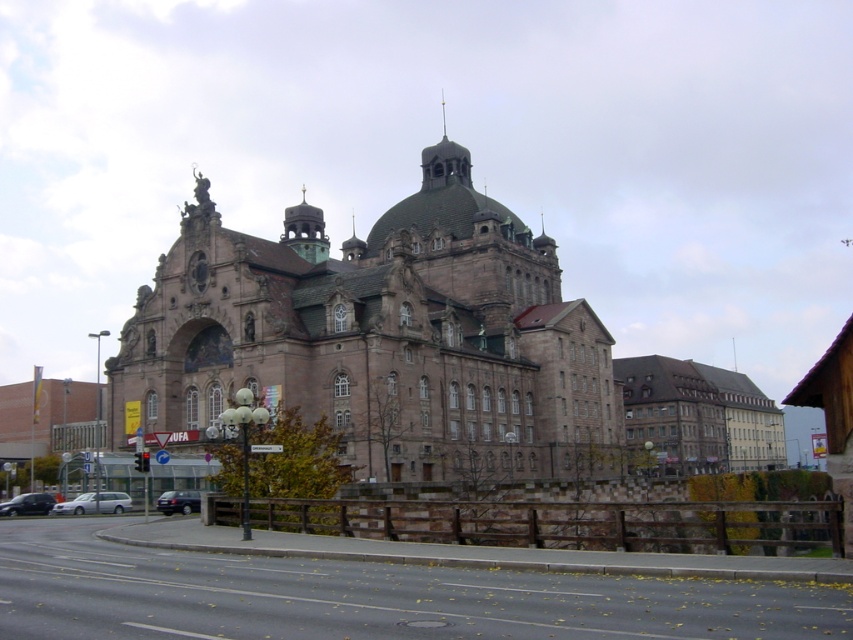
In the scene shown: You are a delivery person who needs to park a van that is 6 meters long. You see the black glossy car at lower left and the dark gray metallic car at lower left. Is there enough space between them to park your van?

The black glossy car at lower left and dark gray metallic car at lower left are 15.60 meters apart, so yes, the van can be parked between them since the space is larger than the van.

You are a pedestrian standing on the paved area in front of the building. You see a silver metallic car at lower left and a black glossy car at lower left. Which car is closer to the streetlight with multiple spherical globes?

The silver metallic car at lower left is to the right of the black glossy car at lower left, so the black glossy car at lower left is closer to the streetlight with multiple spherical globes.

You are a photographer standing on the sidewalk across from the brown stone church at center and the black glossy car at lower left. You want to capture a photo where both subjects are visible. Which subject should you focus on to ensure both are in frame without needing to adjust your camera angle?

You should focus on the brown stone church at center because it is taller than the black glossy car at lower left, so positioning the camera to include its height will naturally include the car in the frame as well.